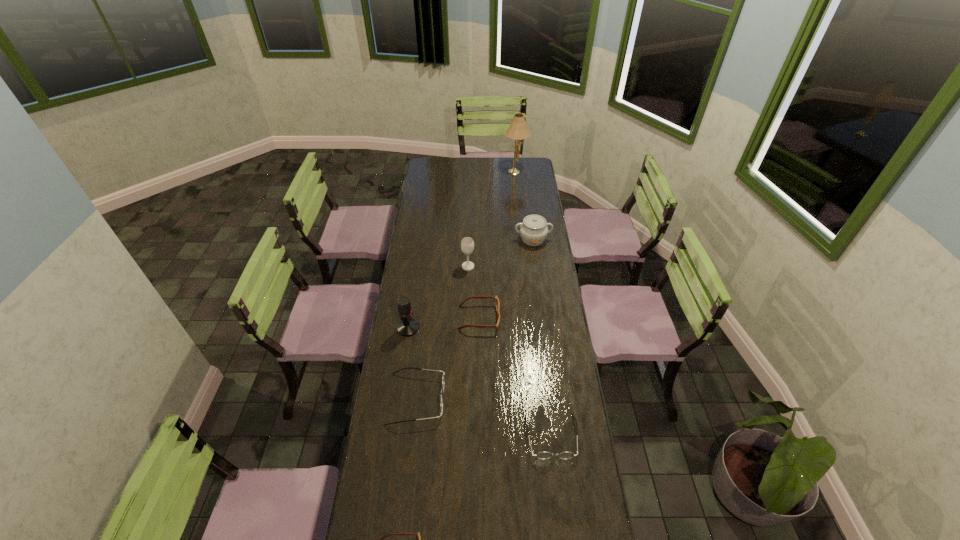
Locate an element on the screen. the tallest object is located at coordinates (518, 130).

Where is `beige lampshade`? The image size is (960, 540). beige lampshade is located at coordinates (518, 130).

Locate an element on the screen. This screenshot has height=540, width=960. red microphone is located at coordinates (407, 326).

This screenshot has height=540, width=960. In order to click on wineglass in this screenshot , I will do `click(467, 244)`.

The image size is (960, 540). In order to click on white chinaware in this screenshot , I will do `click(533, 230)`.

This screenshot has height=540, width=960. Identify the location of chinaware. (533, 230).

Identify the location of the tallest spectacles. This screenshot has height=540, width=960. (441, 396).

The width and height of the screenshot is (960, 540). I want to click on the bigger dark spectacles, so (x=441, y=396).

Locate an element on the screen. The height and width of the screenshot is (540, 960). the bigger brown spectacles is located at coordinates (497, 304).

I want to click on the third spectacles from left to right, so click(497, 304).